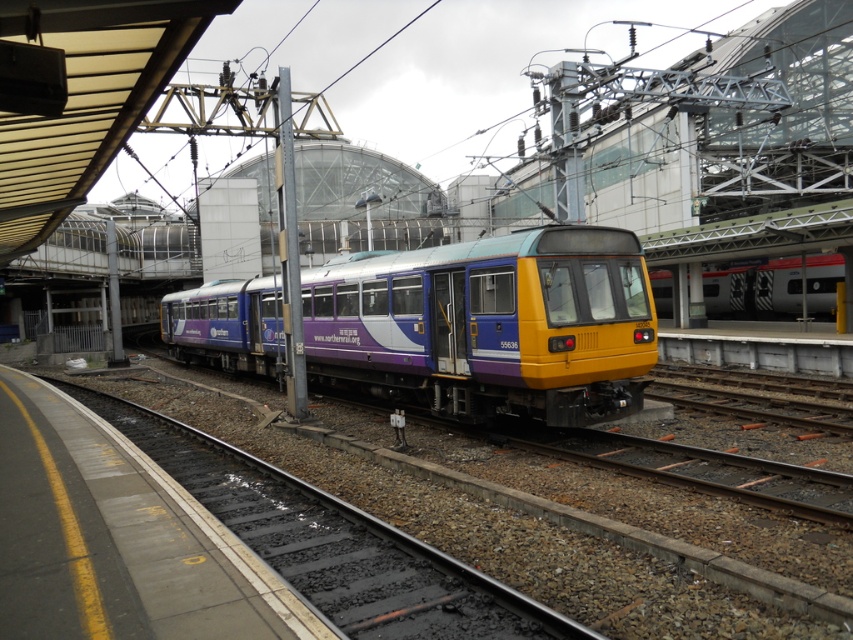
Question: Where is smooth concrete track at center located in relation to red and white striped train at center in the image?

Choices:
 (A) above
 (B) below

Answer: (B)

Question: Which point is farther to the camera?

Choices:
 (A) (799, 289)
 (B) (392, 317)

Answer: (A)

Question: Observing the image, what is the correct spatial positioning of matte purple train at center in reference to red and white striped train at center?

Choices:
 (A) above
 (B) below

Answer: (B)

Question: Based on their relative distances, which object is farther from the smooth concrete track at center?

Choices:
 (A) red and white striped train at center
 (B) matte purple train at center

Answer: (A)

Question: Is matte purple train at center to the left of red and white striped train at center from the viewer's perspective?

Choices:
 (A) no
 (B) yes

Answer: (B)

Question: Which of the following is the closest to the observer?

Choices:
 (A) matte purple train at center
 (B) red and white striped train at center
 (C) smooth concrete track at center

Answer: (C)